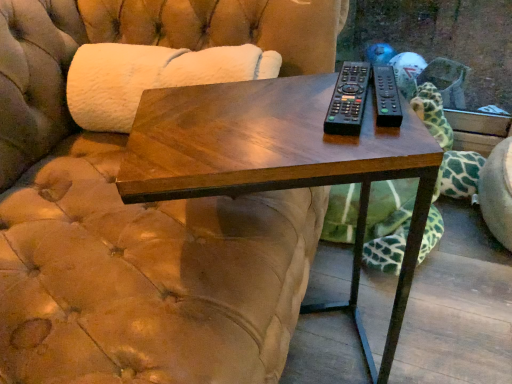
Question: Is green spotted fabric at right further to the viewer compared to black plastic remote at center, positioned as the 1th remote in right-to-left order?

Choices:
 (A) no
 (B) yes

Answer: (B)

Question: Would you say green spotted fabric at right contains black plastic remote at center, positioned as the 1th remote in right-to-left order?

Choices:
 (A) no
 (B) yes

Answer: (A)

Question: Does green spotted fabric at right have a greater height compared to black plastic remote at center, positioned as the 1th remote in right-to-left order?

Choices:
 (A) yes
 (B) no

Answer: (A)

Question: Does green spotted fabric at right lie in front of black plastic remote at center, acting as the second remote starting from the left?

Choices:
 (A) no
 (B) yes

Answer: (A)

Question: Is green spotted fabric at right to the left of black plastic remote at center, acting as the second remote starting from the left, from the viewer's perspective?

Choices:
 (A) no
 (B) yes

Answer: (A)

Question: Is green spotted fabric at right wider or thinner than black plastic remote at center, positioned as the 1th remote in right-to-left order?

Choices:
 (A) thin
 (B) wide

Answer: (B)

Question: Is green spotted fabric at right taller or shorter than black plastic remote at center, positioned as the 1th remote in right-to-left order?

Choices:
 (A) short
 (B) tall

Answer: (B)

Question: In terms of size, does green spotted fabric at right appear bigger or smaller than black plastic remote at center, positioned as the 1th remote in right-to-left order?

Choices:
 (A) small
 (B) big

Answer: (B)

Question: Is point (424, 102) positioned closer to the camera than point (373, 79)?

Choices:
 (A) farther
 (B) closer

Answer: (A)

Question: Is black plastic remote at center, positioned as the 1th remote in right-to-left order, taller or shorter than dark wood table at center?

Choices:
 (A) short
 (B) tall

Answer: (A)

Question: Is black plastic remote at center, acting as the second remote starting from the left, wider or thinner than dark wood table at center?

Choices:
 (A) wide
 (B) thin

Answer: (B)

Question: Based on their sizes in the image, would you say black plastic remote at center, acting as the second remote starting from the left, is bigger or smaller than dark wood table at center?

Choices:
 (A) big
 (B) small

Answer: (B)

Question: Is black plastic remote at center, positioned as the 1th remote in right-to-left order, inside or outside of dark wood table at center?

Choices:
 (A) outside
 (B) inside

Answer: (A)

Question: In terms of height, does dark wood table at center look taller or shorter compared to green spotted fabric at right?

Choices:
 (A) short
 (B) tall

Answer: (B)

Question: From a real-world perspective, relative to green spotted fabric at right, is dark wood table at center vertically above or below?

Choices:
 (A) above
 (B) below

Answer: (A)